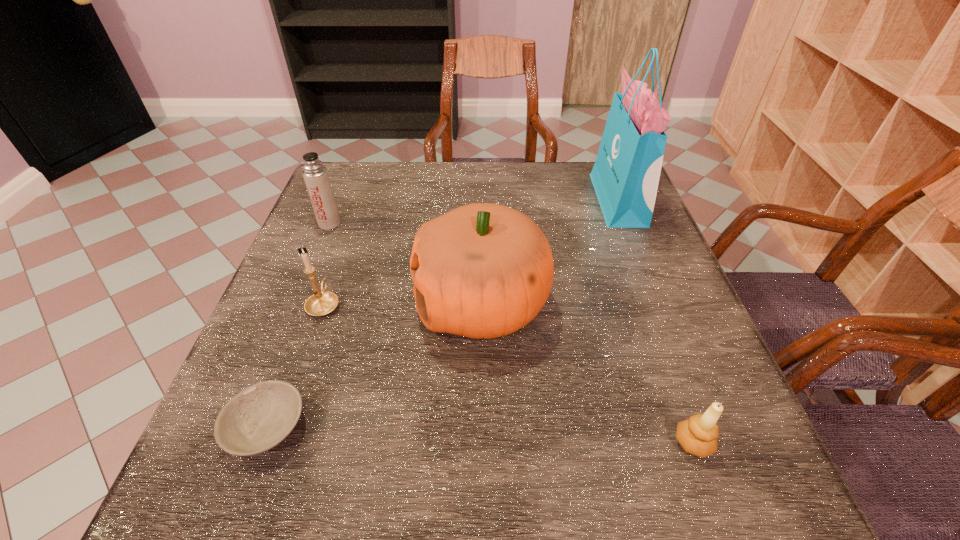
Image resolution: width=960 pixels, height=540 pixels. What are the coordinates of `unoccupied position between the third tallest object and the third shortest object` in the screenshot? It's located at (326, 264).

Identify the location of vacant space that is in between the third shortest object and the third object from right to left. This screenshot has height=540, width=960. (403, 304).

This screenshot has height=540, width=960. I want to click on vacant region between the fourth object from left to right and the right candle_holder, so click(588, 373).

Find the location of a particular element. empty space that is in between the fifth shortest object and the shortest object is located at coordinates (374, 366).

At what (x,y) coordinates should I click in order to perform the action: click on the second closest object to the pumpkin. Please return your answer as a coordinate pair (x, y). Looking at the image, I should click on (257, 419).

Image resolution: width=960 pixels, height=540 pixels. Find the location of `object that is the second closest to the fourth shortest object`. object that is the second closest to the fourth shortest object is located at coordinates (483, 270).

Find the location of a particular element. The height and width of the screenshot is (540, 960). free location that satisfies the following two spatial constraints: 1. on the face of the pumpkin; 2. on the back side of the right candle_holder is located at coordinates point(483,443).

The image size is (960, 540). I want to click on free spot that satisfies the following two spatial constraints: 1. on the front side of the bowl; 2. on the left side of the thermos bottle, so click(x=247, y=427).

Locate an element on the screen. This screenshot has height=540, width=960. vacant space that satisfies the following two spatial constraints: 1. on the back side of the nearer candle_holder; 2. on the right side of the shopping bag is located at coordinates (606, 200).

I want to click on blank space that satisfies the following two spatial constraints: 1. on the back side of the third tallest object; 2. on the left side of the shopping bag, so click(x=339, y=200).